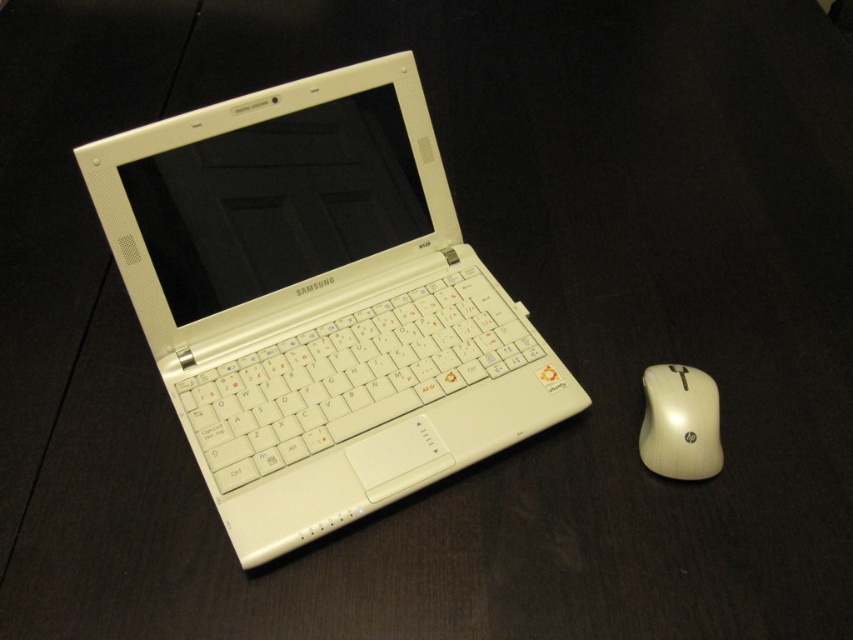
Question: Which point appears farthest from the camera in this image?

Choices:
 (A) (679, 445)
 (B) (502, 321)

Answer: (B)

Question: Which point appears closest to the camera in this image?

Choices:
 (A) (283, 413)
 (B) (444, 228)
 (C) (677, 372)

Answer: (C)

Question: Observing the image, what is the correct spatial positioning of white matte keyboard at center in reference to white plastic mouse at right?

Choices:
 (A) above
 (B) below

Answer: (A)

Question: Can you confirm if white plastic laptop at center is wider than white matte keyboard at center?

Choices:
 (A) yes
 (B) no

Answer: (A)

Question: Among these objects, which one is nearest to the camera?

Choices:
 (A) white plastic mouse at right
 (B) white plastic laptop at center
 (C) white matte keyboard at center

Answer: (B)

Question: Does white plastic laptop at center lie in front of white matte keyboard at center?

Choices:
 (A) yes
 (B) no

Answer: (A)